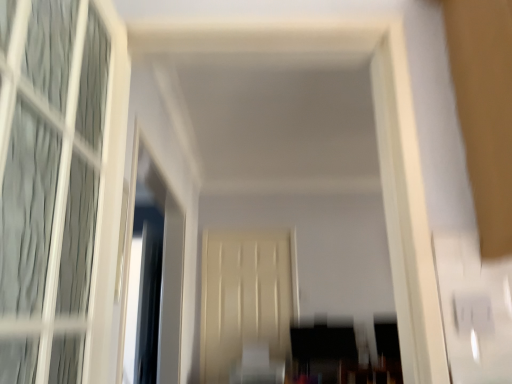
Question: Would you say clear glass window screen at left is part of beige matte door at center's contents?

Choices:
 (A) yes
 (B) no

Answer: (B)

Question: Is beige matte door at center at the left side of clear glass window screen at left?

Choices:
 (A) yes
 (B) no

Answer: (B)

Question: From a real-world perspective, is beige matte door at center positioned over clear glass window screen at left based on gravity?

Choices:
 (A) no
 (B) yes

Answer: (A)

Question: Is beige matte door at center thinner than clear glass window screen at left?

Choices:
 (A) no
 (B) yes

Answer: (B)

Question: Does beige matte door at center turn towards clear glass window screen at left?

Choices:
 (A) yes
 (B) no

Answer: (A)

Question: Does beige matte door at center appear on the right side of clear glass window screen at left?

Choices:
 (A) yes
 (B) no

Answer: (A)

Question: Considering the relative sizes of clear glass window screen at left and beige matte door at center in the image provided, is clear glass window screen at left shorter than beige matte door at center?

Choices:
 (A) yes
 (B) no

Answer: (A)

Question: Considering the relative sizes of clear glass window screen at left and beige matte door at center in the image provided, is clear glass window screen at left thinner than beige matte door at center?

Choices:
 (A) yes
 (B) no

Answer: (B)

Question: Is beige matte door at center inside clear glass window screen at left?

Choices:
 (A) yes
 (B) no

Answer: (B)

Question: From a real-world perspective, is clear glass window screen at left below beige matte door at center?

Choices:
 (A) no
 (B) yes

Answer: (A)

Question: Is clear glass window screen at left behind beige matte door at center?

Choices:
 (A) yes
 (B) no

Answer: (B)

Question: From a real-world perspective, is clear glass window screen at left on beige matte door at center?

Choices:
 (A) yes
 (B) no

Answer: (A)

Question: Considering the positions of clear glass window screen at left and beige matte door at center in the image, is clear glass window screen at left taller or shorter than beige matte door at center?

Choices:
 (A) tall
 (B) short

Answer: (B)